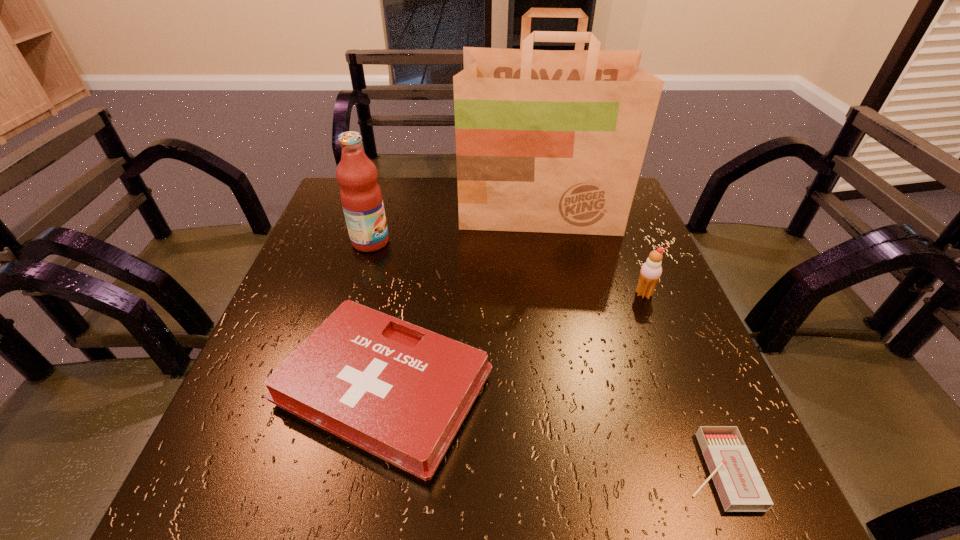
Find the location of a particular element. The height and width of the screenshot is (540, 960). grocery bag is located at coordinates (547, 141).

I want to click on fruit juice, so click(361, 197).

Find the location of a particular element. The height and width of the screenshot is (540, 960). the third tallest object is located at coordinates (651, 270).

Image resolution: width=960 pixels, height=540 pixels. I want to click on icecream, so click(x=651, y=270).

At what (x,y) coordinates should I click in order to perform the action: click on the second shortest object. Please return your answer as a coordinate pair (x, y). The height and width of the screenshot is (540, 960). Looking at the image, I should click on (401, 392).

At what (x,y) coordinates should I click in order to perform the action: click on matchbox. Please return your answer as a coordinate pair (x, y). The image size is (960, 540). Looking at the image, I should click on (740, 487).

Where is `vacant region located 0.170m on the left of the tallest object`? vacant region located 0.170m on the left of the tallest object is located at coordinates (397, 210).

Locate an element on the screen. Image resolution: width=960 pixels, height=540 pixels. vacant position located on the front label of the fourth shortest object is located at coordinates (507, 242).

Where is `free space located at the front with a straw on the third tallest object`? The width and height of the screenshot is (960, 540). free space located at the front with a straw on the third tallest object is located at coordinates (660, 333).

You are a GUI agent. You are given a task and a screenshot of the screen. Output one action in this format:
    pyautogui.click(x=<x>, y=<y>)
    Task: Click on the free space located on the back of the first-aid kit
    The width and height of the screenshot is (960, 540).
    Given the screenshot: What is the action you would take?
    pyautogui.click(x=402, y=294)